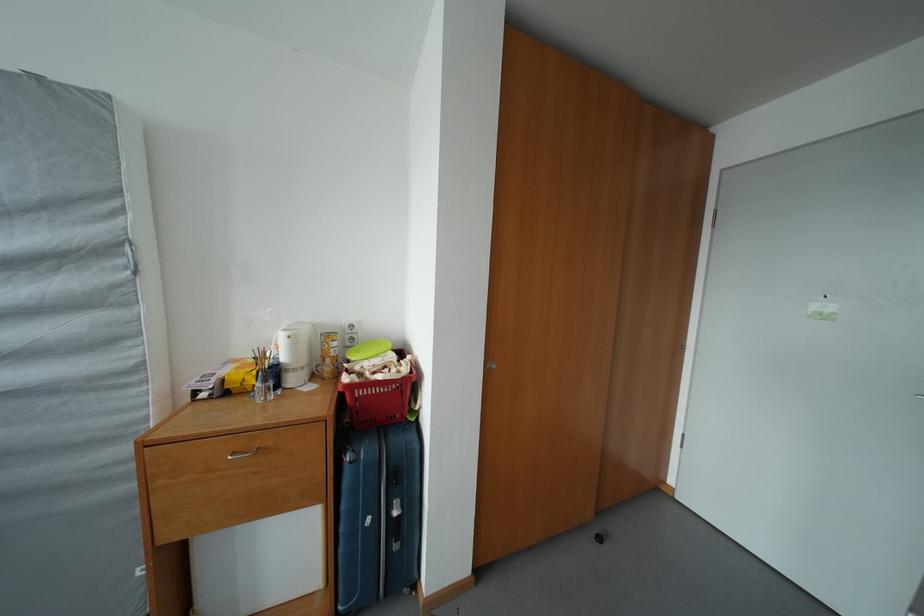
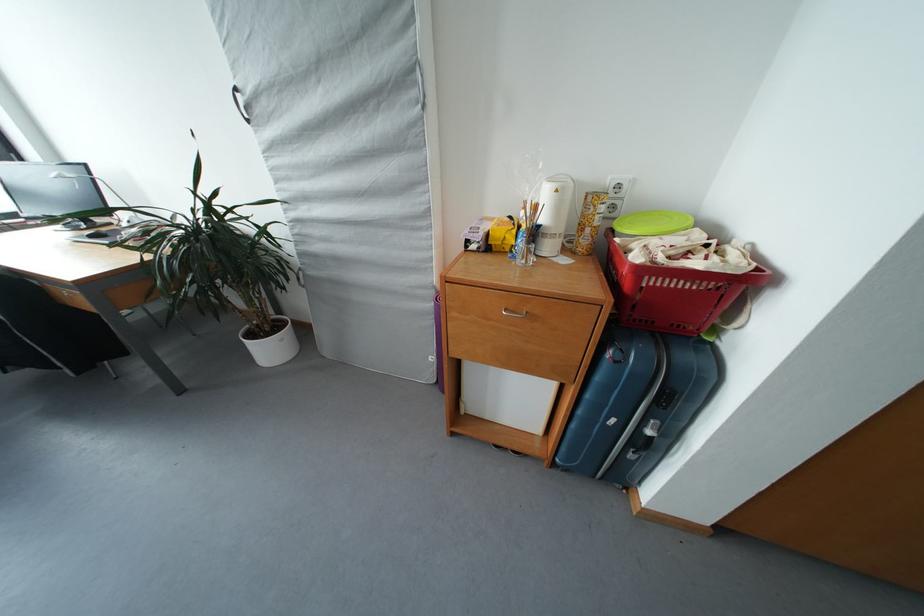
In the second image, find the point that corresponds to point (355, 462) in the first image.

(616, 359)